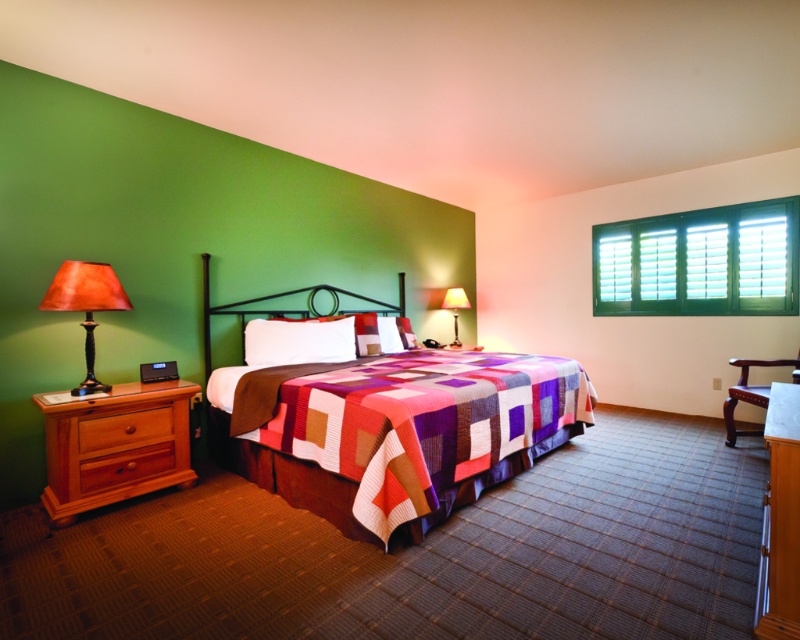
Is multicolored quilted bed at center further to camera compared to brown wood dresser at left?

No, it is in front of brown wood dresser at left.

Can you confirm if multicolored quilted bed at center is wider than brown wood dresser at left?

Correct, the width of multicolored quilted bed at center exceeds that of brown wood dresser at left.

The width and height of the screenshot is (800, 640). What are the coordinates of `multicolored quilted bed at center` in the screenshot? It's located at 401,432.

In the scene shown: Is white glossy dresser at lower right taller than brown wooden chair at lower right?

Yes.

Consider the image. Which of these two, white glossy dresser at lower right or brown wooden chair at lower right, stands taller?

Standing taller between the two is white glossy dresser at lower right.

Is point (760, 592) closer to camera compared to point (741, 394)?

Yes, point (760, 592) is closer to viewer.

Locate an element on the screen. The width and height of the screenshot is (800, 640). white glossy dresser at lower right is located at coordinates (780, 518).

Does matte brown lamp at left lie behind wooden drawer at lower left?

No.

Which is behind, point (81, 308) or point (90, 476)?

Point (90, 476)

This screenshot has width=800, height=640. Describe the element at coordinates (85, 305) in the screenshot. I see `matte brown lamp at left` at that location.

Locate an element on the screen. The width and height of the screenshot is (800, 640). matte brown lamp at left is located at coordinates coord(85,305).